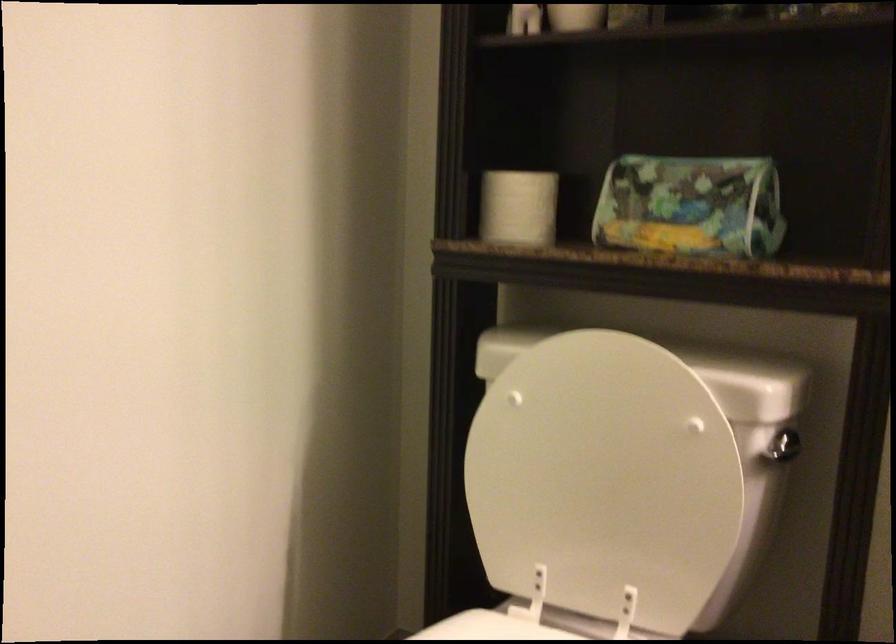
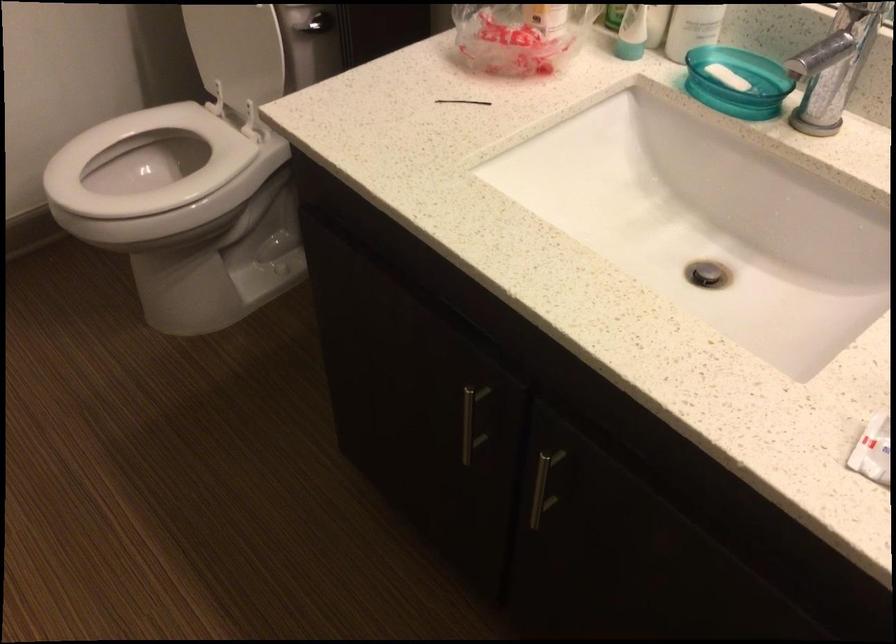
Where in the second image is the point corresponding to [616,518] from the first image?

(237, 51)